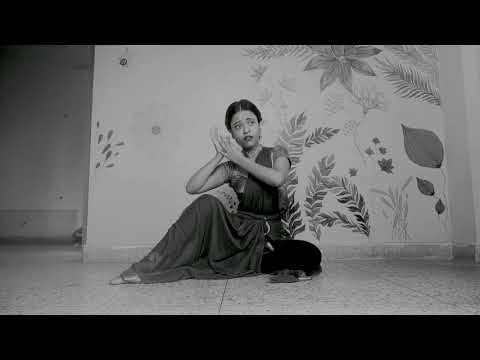
Locate an element on the screen. Image resolution: width=480 pixels, height=360 pixels. wall is located at coordinates (52, 181).